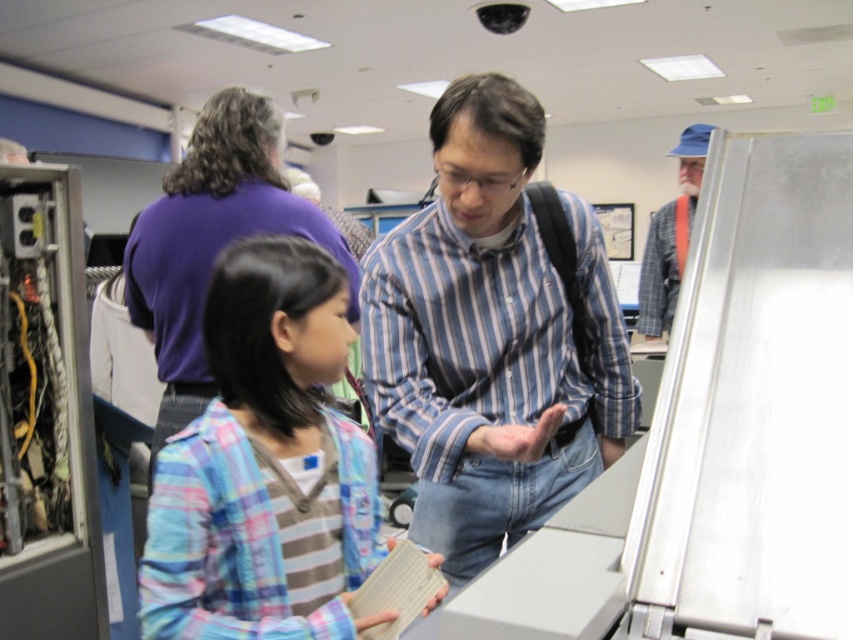
Is plaid fabric shirt at center below blue plaid shirt at upper right?

Correct, plaid fabric shirt at center is located below blue plaid shirt at upper right.

Is plaid fabric shirt at center wider than blue plaid shirt at upper right?

Yes.

This screenshot has height=640, width=853. What do you see at coordinates (265, 465) in the screenshot?
I see `plaid fabric shirt at center` at bounding box center [265, 465].

I want to click on plaid fabric shirt at center, so click(x=265, y=465).

Does point (393, 316) come farther from viewer compared to point (358, 465)?

That is True.

Is blue striped shirt at center behind plaid fabric shirt at center?

That is True.

Where is `blue striped shirt at center`? The height and width of the screenshot is (640, 853). blue striped shirt at center is located at coordinates (491, 337).

Can you confirm if blue striped shirt at center is positioned below blue plaid shirt at upper right?

Indeed, blue striped shirt at center is positioned under blue plaid shirt at upper right.

Based on the photo, can you confirm if blue striped shirt at center is shorter than blue plaid shirt at upper right?

Yes, blue striped shirt at center is shorter than blue plaid shirt at upper right.

This screenshot has height=640, width=853. Describe the element at coordinates (491, 337) in the screenshot. I see `blue striped shirt at center` at that location.

Find the location of `blue striped shirt at center`. blue striped shirt at center is located at coordinates (491, 337).